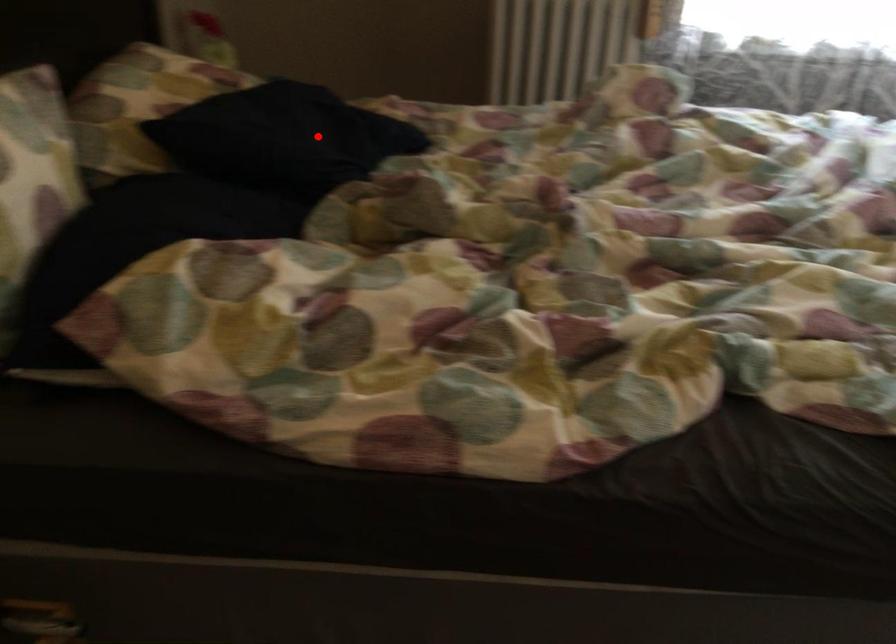
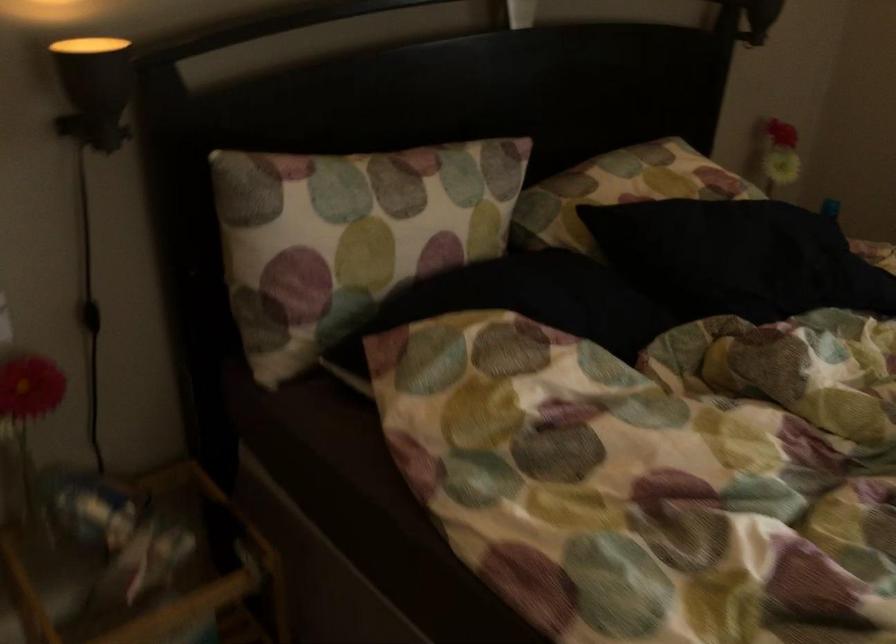
Where in the second image is the point corresponding to the highlighted location from the first image?

(737, 258)